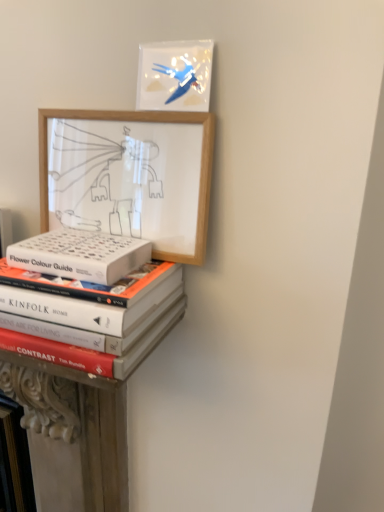
The image size is (384, 512). I want to click on white matte book at center, so [x=80, y=255].

In the scene shown: What is the approximate width of matte plastic picture frame at upper center, the 1th picture frame when ordered from top to bottom?

It is 0.84 inches.

What do you see at coordinates (175, 76) in the screenshot? I see `matte plastic picture frame at upper center, the 1th picture frame when ordered from top to bottom` at bounding box center [175, 76].

Identify the location of hardcover books at lower left. (82, 391).

Is point (82, 487) less distant than point (206, 212)?

No, it is not.

Measure the distance between hardcover books at lower left and wooden picture frame at upper left, the 1th picture frame in the bottom-to-top sequence.

hardcover books at lower left and wooden picture frame at upper left, the 1th picture frame in the bottom-to-top sequence, are 9.16 inches apart from each other.

At what (x,y) coordinates should I click in order to perform the action: click on picture frame that is the 1st object to the right of the hardcover books at lower left, starting at the anchor. Please return your answer as a coordinate pair (x, y). Image resolution: width=384 pixels, height=512 pixels. Looking at the image, I should click on click(x=133, y=173).

From the image's perspective, is hardcover books at lower left located beneath wooden picture frame at upper left, the 2th picture frame when ordered from top to bottom?

Indeed, from the image's perspective, hardcover books at lower left is shown beneath wooden picture frame at upper left, the 2th picture frame when ordered from top to bottom.

Is point (65, 246) positioned before point (120, 121)?

Yes, it is.

Is white matte book at center not close to wooden picture frame at upper left, the 1th picture frame in the bottom-to-top sequence?

No, there isn't a large distance between white matte book at center and wooden picture frame at upper left, the 1th picture frame in the bottom-to-top sequence.

The width and height of the screenshot is (384, 512). Identify the location of picture frame that is the 1st object located above the white matte book at center (from the image's perspective). (133, 173).

From a real-world perspective, which is physically below, white matte book at center or wooden picture frame at upper left, the 1th picture frame in the bottom-to-top sequence?

In real-world perspective, white matte book at center is lower.

From the image's perspective, is white matte book at center positioned above or below hardcover books at lower left?

white matte book at center is situated higher than hardcover books at lower left in the image.

Does white matte book at center have a smaller size compared to hardcover books at lower left?

Correct, white matte book at center occupies less space than hardcover books at lower left.

Would you consider white matte book at center to be distant from hardcover books at lower left?

No.

Identify the location of paperback book that is on the right side of hardcover books at lower left. Image resolution: width=384 pixels, height=512 pixels. (80, 255).

Considering the sizes of objects hardcover books at lower left and matte plastic picture frame at upper center, the 1th picture frame when ordered from top to bottom, in the image provided, who is thinner, hardcover books at lower left or matte plastic picture frame at upper center, the 1th picture frame when ordered from top to bottom,?

With smaller width is matte plastic picture frame at upper center, the 1th picture frame when ordered from top to bottom.

From the image's perspective, is hardcover books at lower left positioned above or below matte plastic picture frame at upper center, positioned as the second picture frame in bottom-to-top order?

Clearly, from the image's perspective, hardcover books at lower left is below matte plastic picture frame at upper center, positioned as the second picture frame in bottom-to-top order.

Which picture frame is the 1st one when counting from the front of the hardcover books at lower left? Please provide its 2D coordinates.

[(175, 76)]

How distant is hardcover books at lower left from matte plastic picture frame at upper center, positioned as the second picture frame in bottom-to-top order?

The distance of hardcover books at lower left from matte plastic picture frame at upper center, positioned as the second picture frame in bottom-to-top order, is 19.49 inches.

How far apart are white matte book at center and hardcover books at lower left?

white matte book at center is 2.12 inches away from hardcover books at lower left.

Considering the positions of objects white matte book at center and hardcover books at lower left in the image provided, who is behind, white matte book at center or hardcover books at lower left?

white matte book at center is more distant.

Based on the photo, between white matte book at center and hardcover books at lower left, which one has larger size?

hardcover books at lower left is bigger.

Considering the positions of points (113, 269) and (167, 286), is point (113, 269) farther from camera compared to point (167, 286)?

That is False.

The image size is (384, 512). Find the location of `bookshelf below the matte plastic picture frame at upper center, positioned as the second picture frame in bottom-to-top order (from the image's perspective)`. bookshelf below the matte plastic picture frame at upper center, positioned as the second picture frame in bottom-to-top order (from the image's perspective) is located at coordinates (82, 391).

Between matte plastic picture frame at upper center, positioned as the second picture frame in bottom-to-top order, and hardcover books at lower left, which one has larger size?

hardcover books at lower left is bigger.

Can you tell me how much matte plastic picture frame at upper center, positioned as the second picture frame in bottom-to-top order, and hardcover books at lower left differ in facing direction?

0.424 degrees.

Can you confirm if wooden picture frame at upper left, the 1th picture frame in the bottom-to-top sequence, is smaller than white matte book at center?

No.

Can we say wooden picture frame at upper left, the 2th picture frame when ordered from top to bottom, lies outside white matte book at center?

Yes, wooden picture frame at upper left, the 2th picture frame when ordered from top to bottom, is outside of white matte book at center.

Considering the points (100, 226) and (18, 257), which point is in front, point (100, 226) or point (18, 257)?

The point (18, 257) is more forward.

From a real-world perspective, is wooden picture frame at upper left, the 1th picture frame in the bottom-to-top sequence, located beneath white matte book at center?

Actually, wooden picture frame at upper left, the 1th picture frame in the bottom-to-top sequence, is physically above white matte book at center in the real world.

Identify the location of picture frame that is the 2nd one when counting forward from the hardcover books at lower left. The image size is (384, 512). (133, 173).

The width and height of the screenshot is (384, 512). Find the location of `paperback book beneath the wooden picture frame at upper left, the 2th picture frame when ordered from top to bottom (from a real-world perspective)`. paperback book beneath the wooden picture frame at upper left, the 2th picture frame when ordered from top to bottom (from a real-world perspective) is located at coordinates (80, 255).

From the image, which object appears to be farther from white matte book at center, matte plastic picture frame at upper center, the 1th picture frame when ordered from top to bottom, or wooden picture frame at upper left, the 1th picture frame in the bottom-to-top sequence?

matte plastic picture frame at upper center, the 1th picture frame when ordered from top to bottom, is positioned further to the anchor white matte book at center.

From the image, which object appears to be nearer to white matte book at center, wooden picture frame at upper left, the 1th picture frame in the bottom-to-top sequence, or hardcover books at lower left?

hardcover books at lower left lies closer to white matte book at center than the other object.

When comparing their distances from white matte book at center, does matte plastic picture frame at upper center, the 1th picture frame when ordered from top to bottom, or hardcover books at lower left seem further?

The object further to white matte book at center is matte plastic picture frame at upper center, the 1th picture frame when ordered from top to bottom.

Which object lies nearer to the anchor point white matte book at center, hardcover books at lower left or hardcover books at lower left?

hardcover books at lower left is closer to white matte book at center.

Considering their positions, is hardcover books at lower left positioned closer to white matte book at center than wooden picture frame at upper left, the 2th picture frame when ordered from top to bottom?

The object closer to white matte book at center is hardcover books at lower left.

Looking at this image, from the image, which object appears to be nearer to white matte book at center, hardcover books at lower left or wooden picture frame at upper left, the 2th picture frame when ordered from top to bottom?

wooden picture frame at upper left, the 2th picture frame when ordered from top to bottom, lies closer to white matte book at center than the other object.

Which object lies nearer to the anchor point matte plastic picture frame at upper center, positioned as the second picture frame in bottom-to-top order, wooden picture frame at upper left, the 2th picture frame when ordered from top to bottom, or white matte book at center?

wooden picture frame at upper left, the 2th picture frame when ordered from top to bottom.

Looking at the image, which one is located further to hardcover books at lower left, hardcover books at lower left or white matte book at center?

Based on the image, hardcover books at lower left appears to be further to hardcover books at lower left.

Where is `picture frame between matte plastic picture frame at upper center, positioned as the second picture frame in bottom-to-top order, and white matte book at center, in the vertical direction`? This screenshot has width=384, height=512. picture frame between matte plastic picture frame at upper center, positioned as the second picture frame in bottom-to-top order, and white matte book at center, in the vertical direction is located at coordinates (133, 173).

Find the location of a particular element. The width and height of the screenshot is (384, 512). book between white matte book at center and hardcover books at lower left in the up-down direction is located at coordinates (87, 313).

What are the coordinates of `picture frame between matte plastic picture frame at upper center, positioned as the second picture frame in bottom-to-top order, and hardcover books at lower left in the up-down direction` in the screenshot? It's located at (133, 173).

The width and height of the screenshot is (384, 512). Find the location of `book between wooden picture frame at upper left, the 2th picture frame when ordered from top to bottom, and hardcover books at lower left, in the vertical direction`. book between wooden picture frame at upper left, the 2th picture frame when ordered from top to bottom, and hardcover books at lower left, in the vertical direction is located at coordinates (87, 313).